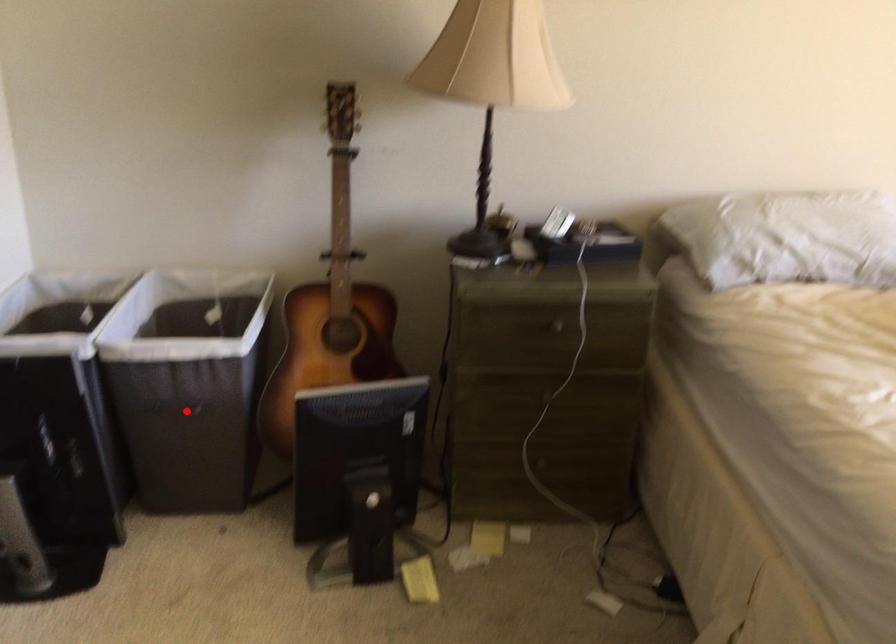
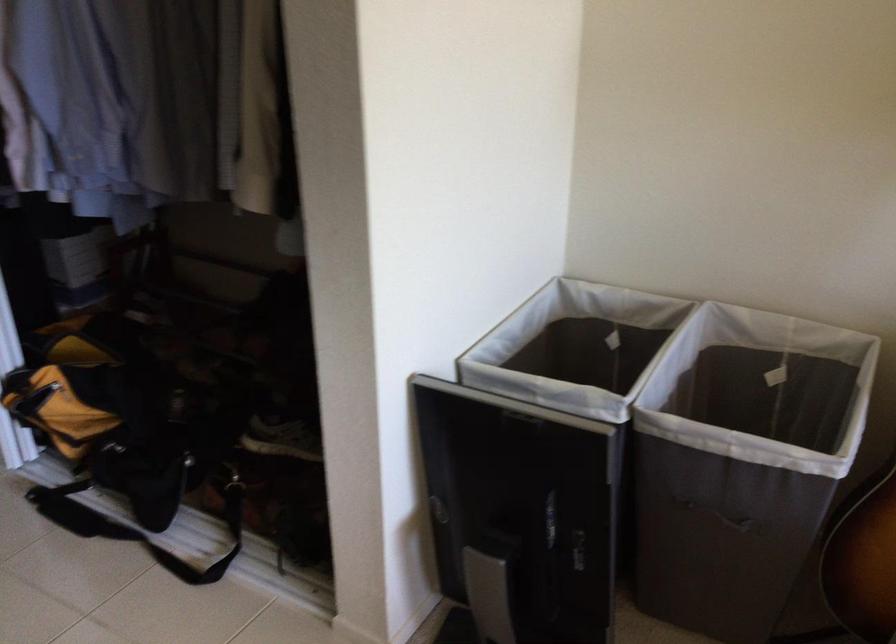
Question: I am providing you with two images of the same scene from different viewpoints. A red point is shown in image1. For the corresponding object point in image2, is it positioned nearer or farther from the camera?

Choices:
 (A) Nearer
 (B) Farther

Answer: (A)